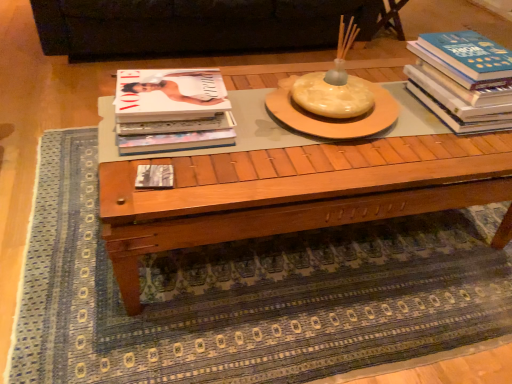
I want to click on free space that is to the left of matte black book at center, marked as the third book in a right-to-left arrangement, so click(117, 173).